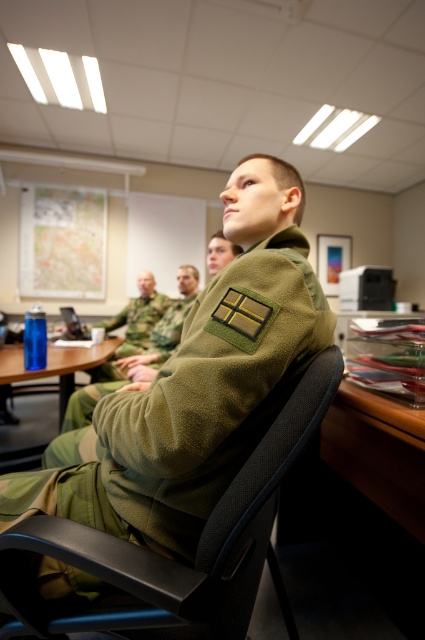
Does point (164, 378) lie in front of point (56, 353)?

That is True.

Based on the photo, how distant is green fleece jacket at center from blue plastic water bottle at left?

The distance of green fleece jacket at center from blue plastic water bottle at left is 38.53 inches.

Describe the element at coordinates (189, 408) in the screenshot. I see `green fleece jacket at center` at that location.

Identify the location of green fleece jacket at center. (189, 408).

Based on the photo, can you confirm if green fleece jacket at center is wider than camouflage fabric uniform at center?

Indeed, green fleece jacket at center has a greater width compared to camouflage fabric uniform at center.

Can you confirm if green fleece jacket at center is shorter than camouflage fabric uniform at center?

No, green fleece jacket at center is not shorter than camouflage fabric uniform at center.

Is point (108, 413) positioned after point (147, 353)?

No, it is in front of (147, 353).

What are the coordinates of `green fleece jacket at center` in the screenshot? It's located at (189, 408).

Who is taller, camouflage fabric uniform at center or green fabric uniform at center?

camouflage fabric uniform at center

Describe the element at coordinates (149, 342) in the screenshot. I see `camouflage fabric uniform at center` at that location.

Which is in front, point (178, 300) or point (223, 260)?

Point (223, 260) is in front.

Locate an element on the screen. camouflage fabric uniform at center is located at coordinates (149, 342).